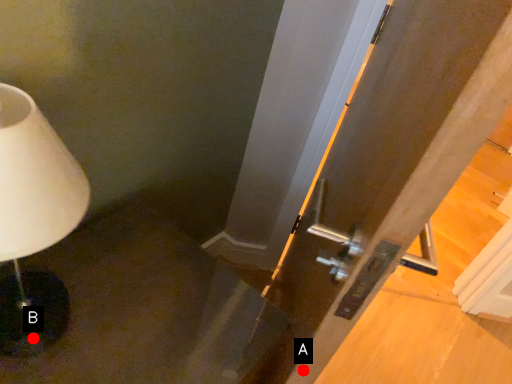
Question: Two points are circled on the image, labeled by A and B beside each circle. Which point is closer to the camera?

Choices:
 (A) A is closer
 (B) B is closer

Answer: (A)